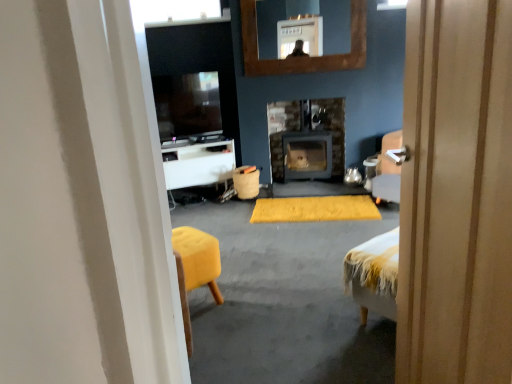
Identify the location of transparent glass window at upper center. (179, 12).

What do you see at coordinates (281, 130) in the screenshot? I see `matte black wood burning stove at center` at bounding box center [281, 130].

The width and height of the screenshot is (512, 384). Describe the element at coordinates (304, 13) in the screenshot. I see `wooden-framed mirror at upper center` at that location.

What do you see at coordinates (199, 164) in the screenshot? This screenshot has height=384, width=512. I see `white glossy table at center` at bounding box center [199, 164].

What is the approximate width of white glossy table at center?

white glossy table at center is 19.12 inches wide.

The image size is (512, 384). Identify the location of transparent glass window at upper center. (179, 12).

Is the surface of yellow fuzzy yoga mat at center in direct contact with matte black wood burning stove at center?

There is a gap between yellow fuzzy yoga mat at center and matte black wood burning stove at center.

Looking at this image, is yellow fuzzy yoga mat at center at the left side of matte black wood burning stove at center?

Correct, you'll find yellow fuzzy yoga mat at center to the left of matte black wood burning stove at center.

Is yellow fuzzy yoga mat at center facing towards matte black wood burning stove at center?

No, yellow fuzzy yoga mat at center is not oriented towards matte black wood burning stove at center.

Looking at this image, is matte black tv at upper center located outside wooden-framed mirror at upper center?

Indeed, matte black tv at upper center is completely outside wooden-framed mirror at upper center.

In terms of size, does matte black tv at upper center appear bigger or smaller than wooden-framed mirror at upper center?

In the image, matte black tv at upper center appears to be larger than wooden-framed mirror at upper center.

Can you confirm if matte black tv at upper center is taller than wooden-framed mirror at upper center?

In fact, matte black tv at upper center may be shorter than wooden-framed mirror at upper center.

Can we say transparent glass window at upper center lies outside wooden door at center?

Yes, transparent glass window at upper center is outside of wooden door at center.

Does transparent glass window at upper center turn towards wooden door at center?

No, transparent glass window at upper center is not aimed at wooden door at center.

Considering the points (162, 21) and (483, 186), which point is behind, point (162, 21) or point (483, 186)?

Point (162, 21)

Consider the image. Does transparent glass window at upper center touch wooden door at center?

No, transparent glass window at upper center is not with wooden door at center.

Which is in front, matte black tv at upper center or wooden door at center?

wooden door at center is in front.

In the scene shown: Does matte black tv at upper center touch wooden door at center?

matte black tv at upper center and wooden door at center are not in contact.

Is matte black tv at upper center surrounding wooden door at center?

No, wooden door at center is located outside of matte black tv at upper center.

Does point (418, 251) appear closer or farther from the camera than point (227, 173)?

Clearly, point (418, 251) is closer to the camera than point (227, 173).

The width and height of the screenshot is (512, 384). Find the location of `door above the white glossy table at center (from a real-world perspective)`. door above the white glossy table at center (from a real-world perspective) is located at coordinates (456, 195).

From a real-world perspective, which is physically above, wooden door at center or white glossy table at center?

wooden door at center is physically above.

Is wooden door at center located outside wooden-framed mirror at upper center?

That's correct, wooden door at center is outside of wooden-framed mirror at upper center.

Considering their positions, is wooden door at center located in front of or behind wooden-framed mirror at upper center?

In the image, wooden door at center appears in front of wooden-framed mirror at upper center.

Who is taller, wooden door at center or wooden-framed mirror at upper center?

Standing taller between the two is wooden door at center.

Can you confirm if matte black wood burning stove at center is positioned to the left of white glossy table at center?

No.

Is matte black wood burning stove at center far from white glossy table at center?

No, matte black wood burning stove at center is not far away from white glossy table at center.

How far apart are matte black wood burning stove at center and white glossy table at center?

matte black wood burning stove at center is 77.19 centimeters from white glossy table at center.

Looking at this image, how many degrees apart are the facing directions of matte black wood burning stove at center and white glossy table at center?

There is a 32.4-degree angle between the facing directions of matte black wood burning stove at center and white glossy table at center.

I want to click on yoga mat on the left of matte black wood burning stove at center, so click(314, 209).

The width and height of the screenshot is (512, 384). What are the coordinates of `television in front of the wooden-framed mirror at upper center` in the screenshot? It's located at (187, 104).

Which object lies nearer to the anchor point matte black tv at upper center, burlap-like fabric trash can at center or wooden-framed mirror at upper center?

The object closer to matte black tv at upper center is burlap-like fabric trash can at center.

Which object lies nearer to the anchor point white glossy table at center, wooden door at center or wooden-framed mirror at upper center?

wooden-framed mirror at upper center lies closer to white glossy table at center than the other object.

Which object lies nearer to the anchor point yellow fuzzy yoga mat at center, wooden door at center or wooden-framed mirror at upper center?

Among the two, wooden-framed mirror at upper center is located nearer to yellow fuzzy yoga mat at center.

Considering their positions, is wooden-framed mirror at upper center positioned closer to burlap-like fabric trash can at center than yellow fuzzy yoga mat at center?

Based on the image, yellow fuzzy yoga mat at center appears to be nearer to burlap-like fabric trash can at center.

From the image, which object appears to be nearer to white glossy table at center, matte black tv at upper center or transparent glass window at upper center?

Among the two, matte black tv at upper center is located nearer to white glossy table at center.

Based on the photo, looking at the image, which one is located further to transparent glass window at upper center, wooden-framed mirror at upper center or matte black wood burning stove at center?

matte black wood burning stove at center lies further to transparent glass window at upper center than the other object.

Looking at the image, which one is located further to wooden door at center, matte black wood burning stove at center or yellow fuzzy yoga mat at center?

Among the two, matte black wood burning stove at center is located further to wooden door at center.

From the image, which object appears to be nearer to yellow fuzzy yoga mat at center, wooden-framed mirror at upper center or burlap-like fabric trash can at center?

burlap-like fabric trash can at center.

Locate an element on the screen. Image resolution: width=512 pixels, height=384 pixels. mirror between transparent glass window at upper center and yellow fuzzy yoga mat at center in the vertical direction is located at coordinates (304, 13).

Locate an element on the screen. television between transparent glass window at upper center and yellow fuzzy yoga mat at center in the vertical direction is located at coordinates (187, 104).

Identify the location of mirror between wooden door at center and matte black wood burning stove at center along the z-axis. (304, 13).

The image size is (512, 384). I want to click on mirror between matte black tv at upper center and matte black wood burning stove at center, so coord(304,13).